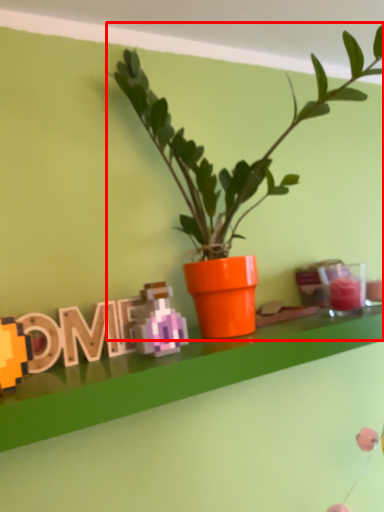
Question: From the image's perspective, what is the correct spatial relationship of houseplant (annotated by the red box) in relation to alphabet?

Choices:
 (A) above
 (B) below

Answer: (A)